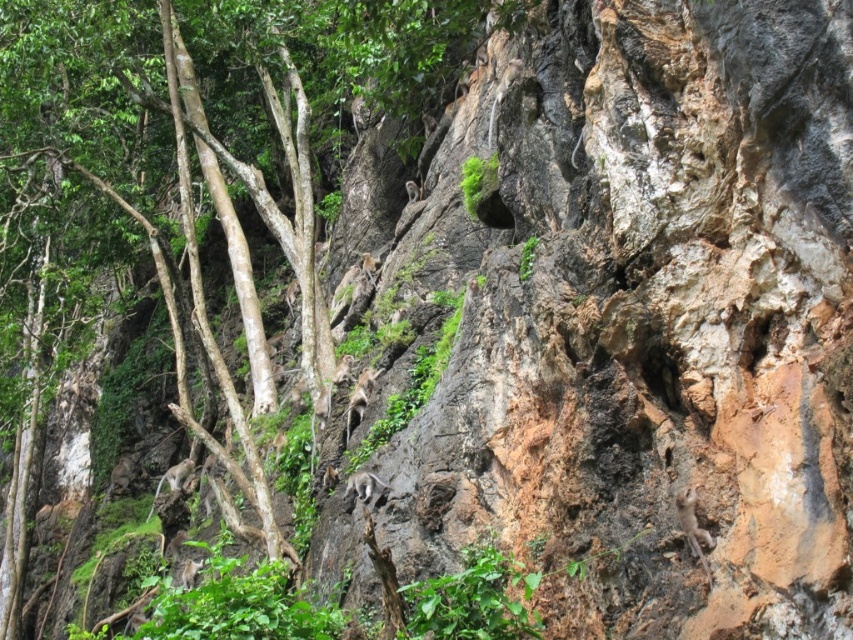
Question: Can you confirm if brown rough rock at upper center is positioned below green leafy tree at center?

Choices:
 (A) yes
 (B) no

Answer: (A)

Question: Can you confirm if brown rough rock at upper center is wider than green leafy tree at center?

Choices:
 (A) yes
 (B) no

Answer: (B)

Question: Which point is closer to the camera?

Choices:
 (A) green leafy tree at center
 (B) brown rough rock at upper center

Answer: (B)

Question: Which of the following is the farthest from the observer?

Choices:
 (A) coord(546,198)
 (B) coord(292,67)

Answer: (B)

Question: Can you confirm if brown rough rock at upper center is positioned above green leafy tree at center?

Choices:
 (A) yes
 (B) no

Answer: (B)